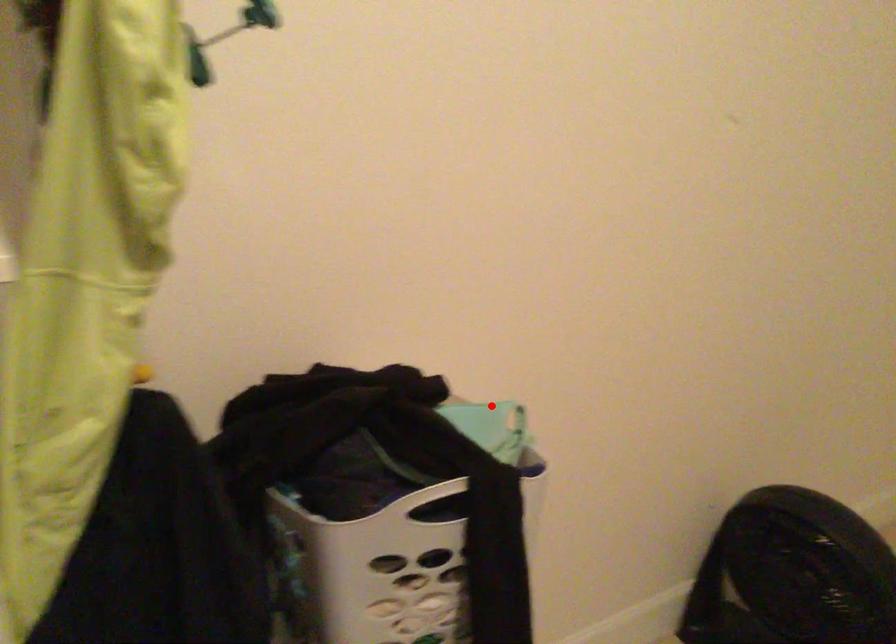
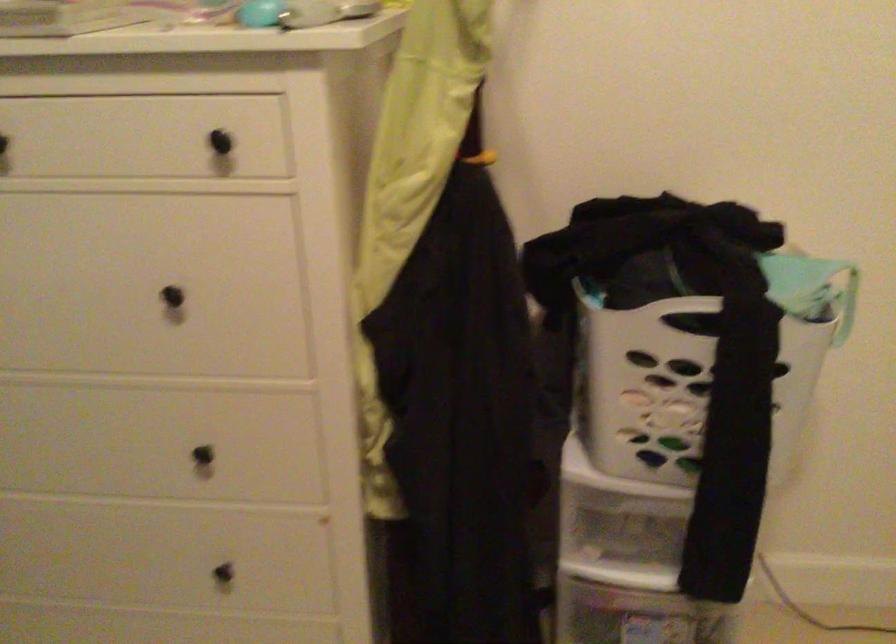
Find the pixel in the second image that matches the highlighted location in the first image.

(825, 261)